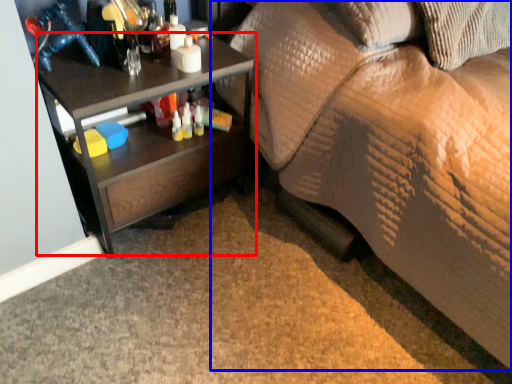
Question: Which of the following is the farthest to the observer, desk (highlighted by a red box) or studio couch (highlighted by a blue box)?

Choices:
 (A) desk
 (B) studio couch

Answer: (A)